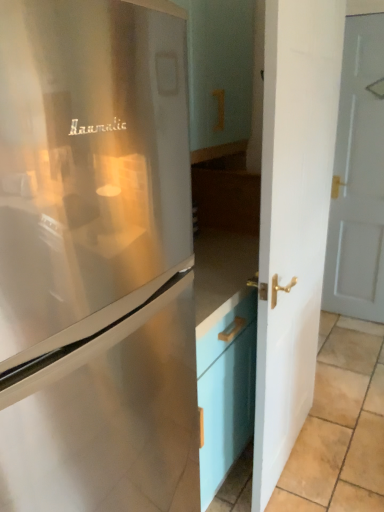
Question: Is satin silver refrigerator at left bigger or smaller than beige tile at lower right?

Choices:
 (A) small
 (B) big

Answer: (B)

Question: Do you think satin silver refrigerator at left is within beige tile at lower right, or outside of it?

Choices:
 (A) inside
 (B) outside

Answer: (B)

Question: Estimate the real-world distances between objects in this image. Which object is closer to the satin silver refrigerator at left?

Choices:
 (A) beige tile at lower right
 (B) white glossy door at center, marked as the second door in a right-to-left arrangement
 (C) white painted wood door at right, the second door when ordered from front to back

Answer: (B)

Question: Estimate the real-world distances between objects in this image. Which object is farther from the white glossy door at center, the 1th door in the front-to-back sequence?

Choices:
 (A) beige tile at lower right
 (B) white painted wood door at right, which appears as the 1th door when viewed from the right
 (C) satin silver refrigerator at left

Answer: (B)